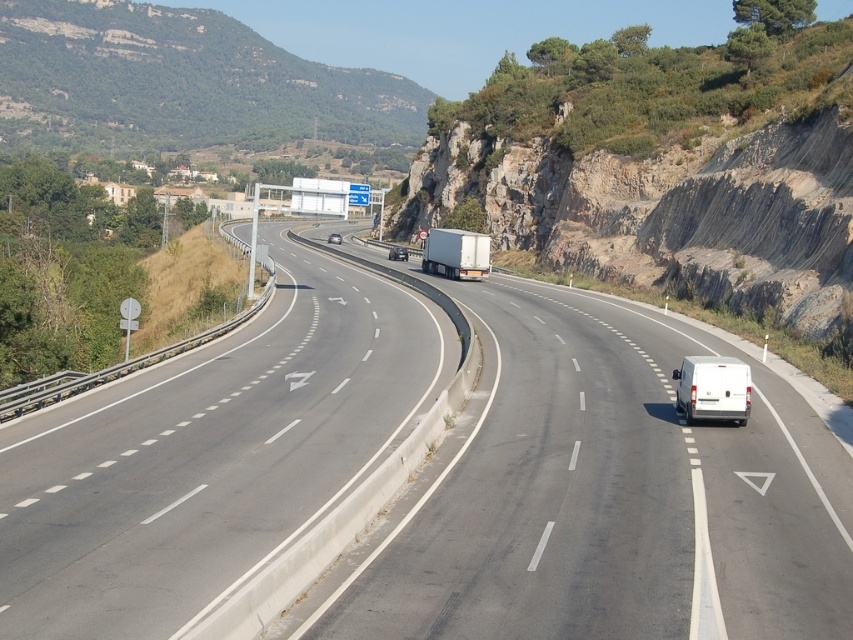
Question: Is rocky cliff at upper right closer to camera compared to white matte van at right?

Choices:
 (A) no
 (B) yes

Answer: (A)

Question: Among these objects, which one is farthest from the camera?

Choices:
 (A) shiny silver sedan at center
 (B) white matte van at center-right
 (C) white matte van at center

Answer: (C)

Question: Is white matte van at right positioned in front of white matte van at center?

Choices:
 (A) yes
 (B) no

Answer: (A)

Question: Among these objects, which one is nearest to the camera?

Choices:
 (A) rocky cliff at upper right
 (B) white matte van at center-right

Answer: (B)

Question: Which point is closer to the camera?

Choices:
 (A) (485, 275)
 (B) (698, 548)
 (C) (693, 374)

Answer: (B)

Question: Does white matte van at center-right have a greater width compared to white matte van at right?

Choices:
 (A) yes
 (B) no

Answer: (A)